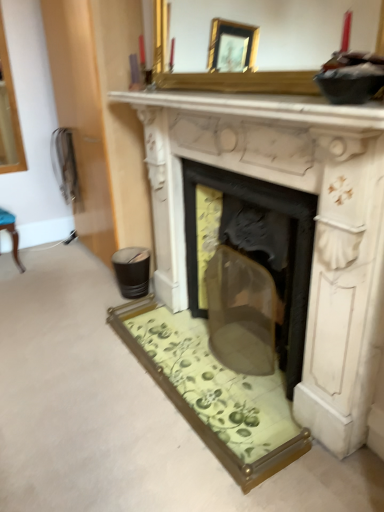
Question: Should I look upward or downward to see gold-framed mirror at upper center?

Choices:
 (A) down
 (B) up

Answer: (B)

Question: Is gold-framed mirror at upper center oriented towards white marble fireplace at center?

Choices:
 (A) yes
 (B) no

Answer: (B)

Question: Can you confirm if gold-framed mirror at upper center is wider than white marble fireplace at center?

Choices:
 (A) yes
 (B) no

Answer: (B)

Question: From a real-world perspective, is gold-framed mirror at upper center positioned under white marble fireplace at center based on gravity?

Choices:
 (A) yes
 (B) no

Answer: (B)

Question: Is gold-framed mirror at upper center positioned in front of white marble fireplace at center?

Choices:
 (A) yes
 (B) no

Answer: (A)

Question: Does gold-framed mirror at upper center appear on the left side of white marble fireplace at center?

Choices:
 (A) no
 (B) yes

Answer: (B)

Question: From the image's perspective, is gold-framed mirror at upper center under white marble fireplace at center?

Choices:
 (A) no
 (B) yes

Answer: (A)

Question: Can you confirm if gold-framed mirror at upper center is taller than white marble fireplace at upper center?

Choices:
 (A) yes
 (B) no

Answer: (A)

Question: From a real-world perspective, is gold-framed mirror at upper center physically below white marble fireplace at upper center?

Choices:
 (A) yes
 (B) no

Answer: (B)

Question: Does gold-framed mirror at upper center appear on the left side of white marble fireplace at upper center?

Choices:
 (A) no
 (B) yes

Answer: (A)

Question: Is gold-framed mirror at upper center smaller than white marble fireplace at upper center?

Choices:
 (A) yes
 (B) no

Answer: (B)

Question: Considering the relative sizes of gold-framed mirror at upper center and white marble fireplace at upper center in the image provided, is gold-framed mirror at upper center wider than white marble fireplace at upper center?

Choices:
 (A) yes
 (B) no

Answer: (B)

Question: Does gold-framed mirror at upper center contain white marble fireplace at upper center?

Choices:
 (A) yes
 (B) no

Answer: (B)

Question: Is white marble fireplace at center surrounding white marble fireplace at upper center?

Choices:
 (A) yes
 (B) no

Answer: (B)